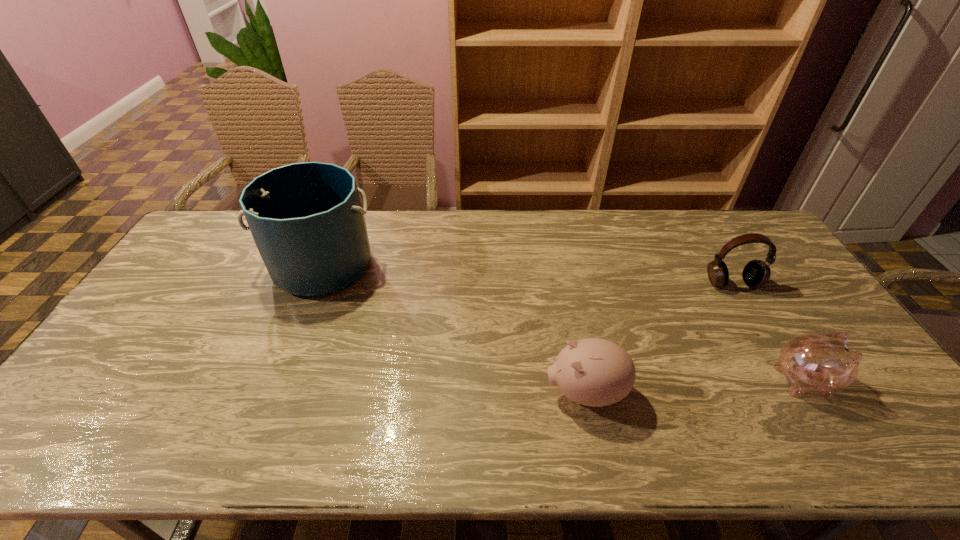
Find the location of `the tallest object`. the tallest object is located at coordinates (306, 219).

Locate an element on the screen. This screenshot has height=540, width=960. bucket is located at coordinates (306, 219).

Where is `headset`? headset is located at coordinates (756, 273).

At what (x,y) coordinates should I click in order to perform the action: click on the left piggy bank. Please return your answer as a coordinate pair (x, y). This screenshot has height=540, width=960. Looking at the image, I should click on (595, 372).

Locate an element on the screen. The height and width of the screenshot is (540, 960). the right piggy bank is located at coordinates (821, 363).

The image size is (960, 540). What are the coordinates of `blank space located 0.380m on the front of the leftmost object` in the screenshot? It's located at (262, 417).

I want to click on free space located 0.070m on the ear pads of the headset, so click(748, 309).

Where is `free location located 0.290m at the snout of the left piggy bank`? The image size is (960, 540). free location located 0.290m at the snout of the left piggy bank is located at coordinates (427, 393).

Locate an element on the screen. Image resolution: width=960 pixels, height=540 pixels. free region located 0.100m at the snout of the left piggy bank is located at coordinates (504, 393).

This screenshot has width=960, height=540. Find the location of `free spot located at the snout of the left piggy bank`. free spot located at the snout of the left piggy bank is located at coordinates (488, 393).